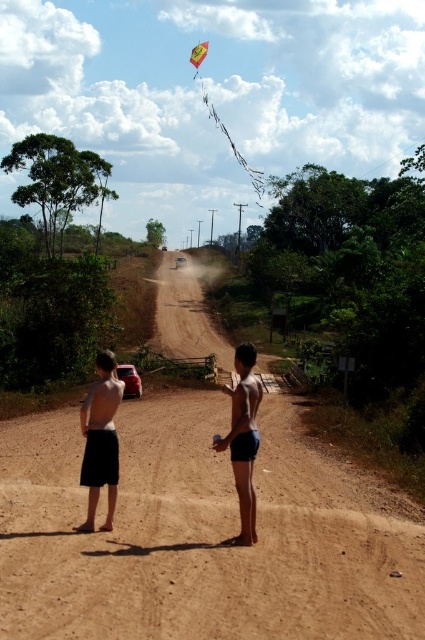
Which is behind, point (87, 445) or point (189, 61)?

Point (189, 61)

Describe the element at coordinates (101, 440) in the screenshot. I see `black shorts at center` at that location.

Which is in front, point (85, 458) or point (204, 52)?

Positioned in front is point (85, 458).

This screenshot has width=425, height=640. I want to click on black shorts at center, so click(101, 440).

Does dark blue shorts at center have a lesser width compared to smooth blue shorts at center?

Incorrect, dark blue shorts at center's width is not less than smooth blue shorts at center's.

Does dark blue shorts at center have a greater width compared to smooth blue shorts at center?

Indeed, dark blue shorts at center has a greater width compared to smooth blue shorts at center.

The image size is (425, 640). I want to click on dark blue shorts at center, so click(243, 438).

Is point (243, 356) behind point (198, 49)?

No, (243, 356) is closer to viewer.

Who is lower down, smooth blue shorts at center or yellow fabric kite at upper center?

smooth blue shorts at center is below.

This screenshot has height=640, width=425. Describe the element at coordinates (243, 438) in the screenshot. I see `smooth blue shorts at center` at that location.

Locate an element on the screen. This screenshot has height=640, width=425. smooth blue shorts at center is located at coordinates (243, 438).